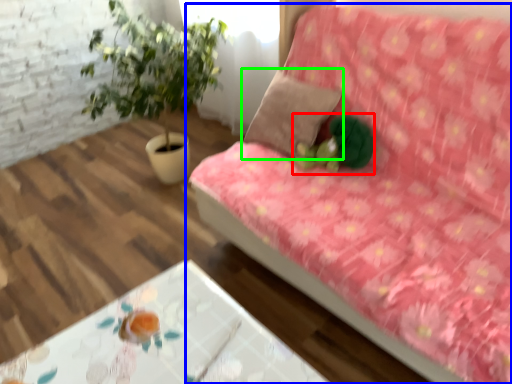
Question: Estimate the real-world distances between objects in this image. Which object is farther from toy (highlighted by a red box), studio couch (highlighted by a blue box) or pillow (highlighted by a green box)?

Choices:
 (A) studio couch
 (B) pillow

Answer: (A)